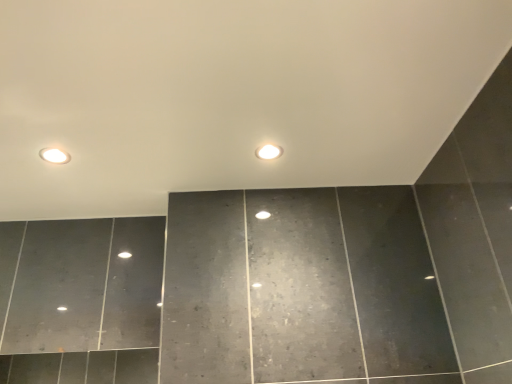
What do you see at coordinates (54, 155) in the screenshot? Image resolution: width=512 pixels, height=384 pixels. I see `matte white recessed light at upper left` at bounding box center [54, 155].

Where is `matte white recessed light at upper left`? matte white recessed light at upper left is located at coordinates tap(54, 155).

What is the approximate height of matte white recessed light at upper left?

matte white recessed light at upper left is 0.42 inches tall.

What do you see at coordinates (269, 152) in the screenshot? The height and width of the screenshot is (384, 512). I see `white glossy light bulb at center` at bounding box center [269, 152].

The image size is (512, 384). Identify the location of white glossy light bulb at center. (269, 152).

You are a GUI agent. You are given a task and a screenshot of the screen. Output one action in this format:
    pyautogui.click(x=<x>, y=<y>)
    Task: Click on the matte white recessed light at upper left
    
    Given the screenshot: What is the action you would take?
    pyautogui.click(x=54, y=155)

Which is more to the left, matte white recessed light at upper left or white glossy light bulb at center?

From the viewer's perspective, matte white recessed light at upper left appears more on the left side.

Is the position of matte white recessed light at upper left less distant than that of white glossy light bulb at center?

Yes, the depth of matte white recessed light at upper left is less than that of white glossy light bulb at center.

Between point (51, 159) and point (271, 148), which one is positioned behind?

Positioned behind is point (271, 148).

From the image's perspective, between matte white recessed light at upper left and white glossy light bulb at center, which one is located above?

white glossy light bulb at center is shown above in the image.

From a real-world perspective, relative to white glossy light bulb at center, is matte white recessed light at upper left vertically above or below?

matte white recessed light at upper left is situated higher than white glossy light bulb at center in the real world.

Between matte white recessed light at upper left and white glossy light bulb at center, which one has larger width?

matte white recessed light at upper left is wider.

Which of these two, matte white recessed light at upper left or white glossy light bulb at center, stands shorter?

matte white recessed light at upper left is shorter.

Which of these two, matte white recessed light at upper left or white glossy light bulb at center, is smaller?

matte white recessed light at upper left.

Choose the correct answer: Is matte white recessed light at upper left inside white glossy light bulb at center or outside it?

matte white recessed light at upper left exists outside the volume of white glossy light bulb at center.

Is matte white recessed light at upper left far away from white glossy light bulb at center?

They are positioned close to each other.

Is matte white recessed light at upper left looking in the opposite direction of white glossy light bulb at center?

No, matte white recessed light at upper left's orientation is not away from white glossy light bulb at center.

What's the angular difference between matte white recessed light at upper left and white glossy light bulb at center's facing directions?

The angular difference between matte white recessed light at upper left and white glossy light bulb at center is 0.464 degrees.

You are a GUI agent. You are given a task and a screenshot of the screen. Output one action in this format:
    pyautogui.click(x=<x>, y=<y>)
    Task: Click on the light bulb on the right side of matte white recessed light at upper left
    The width and height of the screenshot is (512, 384).
    Given the screenshot: What is the action you would take?
    pyautogui.click(x=269, y=152)

In the image, is white glossy light bulb at center on the left side or the right side of matte white recessed light at upper left?

Clearly, white glossy light bulb at center is on the right of matte white recessed light at upper left in the image.

Does white glossy light bulb at center come behind matte white recessed light at upper left?

Yes, white glossy light bulb at center is behind matte white recessed light at upper left.

Which is nearer, (280, 153) or (67, 160)?

Point (280, 153) is farther from the camera than point (67, 160).

From the image's perspective, is white glossy light bulb at center below matte white recessed light at upper left?

No, from the image's perspective, white glossy light bulb at center is not beneath matte white recessed light at upper left.

From a real-world perspective, between white glossy light bulb at center and matte white recessed light at upper left, who is vertically lower?

white glossy light bulb at center, from a real-world perspective.

Does white glossy light bulb at center have a lesser width compared to matte white recessed light at upper left?

Yes.

Between white glossy light bulb at center and matte white recessed light at upper left, which one has more height?

white glossy light bulb at center is taller.

Is white glossy light bulb at center bigger than matte white recessed light at upper left?

Yes.

Looking at this image, do you think white glossy light bulb at center is within matte white recessed light at upper left, or outside of it?

white glossy light bulb at center exists outside the volume of matte white recessed light at upper left.

Is white glossy light bulb at center far from matte white recessed light at upper left?

No.

Does white glossy light bulb at center turn towards matte white recessed light at upper left?

No, white glossy light bulb at center is not oriented towards matte white recessed light at upper left.

How many degrees apart are the facing directions of white glossy light bulb at center and matte white recessed light at upper left?

The angle between the facing direction of white glossy light bulb at center and the facing direction of matte white recessed light at upper left is 0.464 degrees.

This screenshot has height=384, width=512. I want to click on fixture below the white glossy light bulb at center (from the image's perspective), so [x=54, y=155].

Where is `light bulb that appears on the right of matte white recessed light at upper left`? Image resolution: width=512 pixels, height=384 pixels. light bulb that appears on the right of matte white recessed light at upper left is located at coordinates (269, 152).

Find the location of `fixture above the white glossy light bulb at center (from a real-world perspective)`. fixture above the white glossy light bulb at center (from a real-world perspective) is located at coordinates (54, 155).